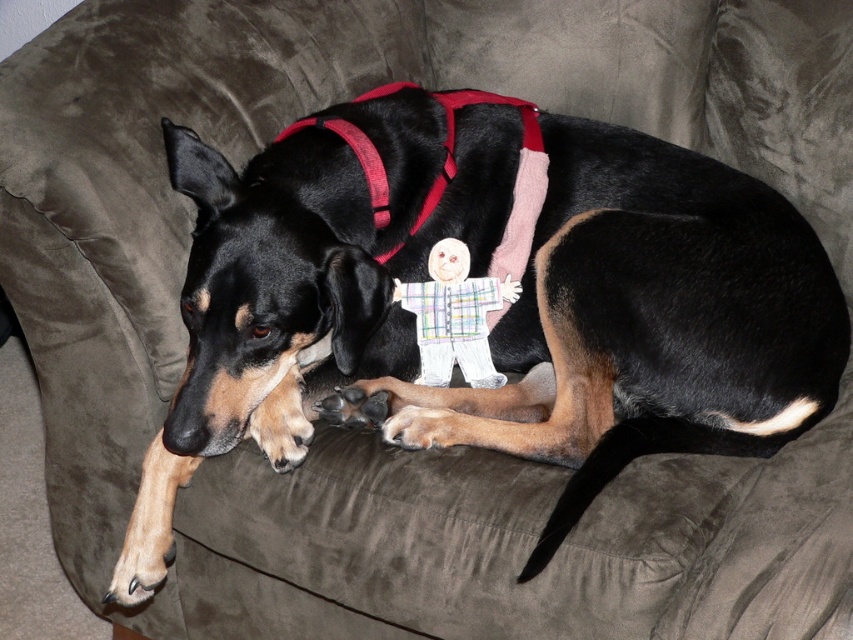
Based on the scene described, can you determine which object is bigger between the black smooth dog at center and the plaid fabric doll at center?

The black smooth dog at center is larger in size than the plaid fabric doll at center.

You are standing in front of a camera that is pointed at the black smooth dog at center. If you want to take a photo of the dog without any distortion, what is the minimum distance you should stand from the camera?

The black smooth dog at center and camera are 4.28 feet apart, so you should stand at least 4.28 feet away from the camera to avoid distortion and capture the dog clearly.

Based on the scene description, which object is positioned to the right when observing the black smooth dog at center and the plaid fabric doll at center?

The plaid fabric doll at center is to the right of the black smooth dog at center.